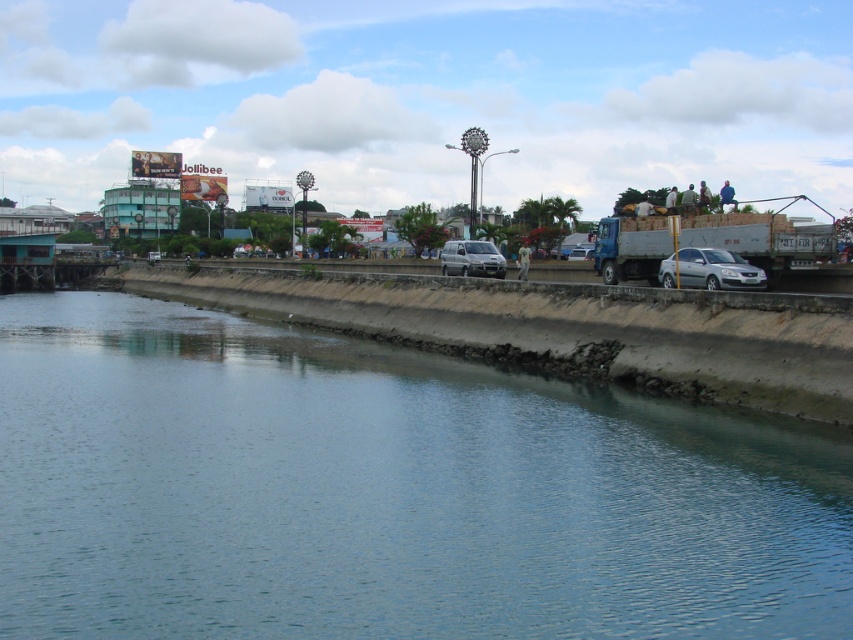
You are a delivery driver who needs to park your vehicle between two vans on the riverside road. The vehicles available are the satin silver van at center and the matte silver van at center. Which van should you choose to park if you want the widest possible space between them?

The satin silver van at center is wider than the matte silver van at center, so choosing the satin silver van at center will provide a wider space between the two vans.

You are a pedestrian standing on the riverside path. You see the clear water at lower left and the silver metallic sedan at center. Which object is closer to you?

The clear water at lower left is positioned under the silver metallic sedan at center, so the silver metallic sedan at center is closer to you.

You are standing on the riverside path and want to cross to the other side. There is a clear water at lower left and a silver metallic sedan at center. Which object should you avoid stepping on to stay dry?

You should avoid stepping on the silver metallic sedan at center because the clear water at lower left is to the left of it, meaning the sedan is on the dry road while the water is nearby but not underfoot.